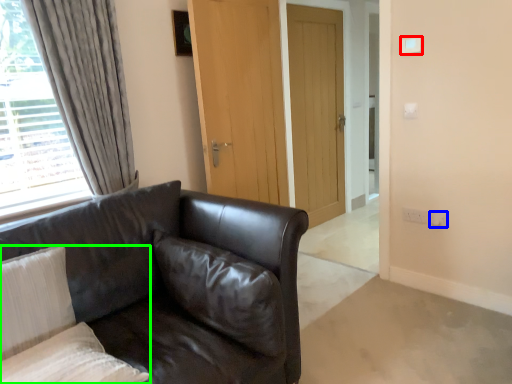
Question: Which object is positioned farthest from light switch (highlighted by a red box)? Select from electric outlet (highlighted by a blue box) and pillow (highlighted by a green box).

Choices:
 (A) electric outlet
 (B) pillow

Answer: (B)